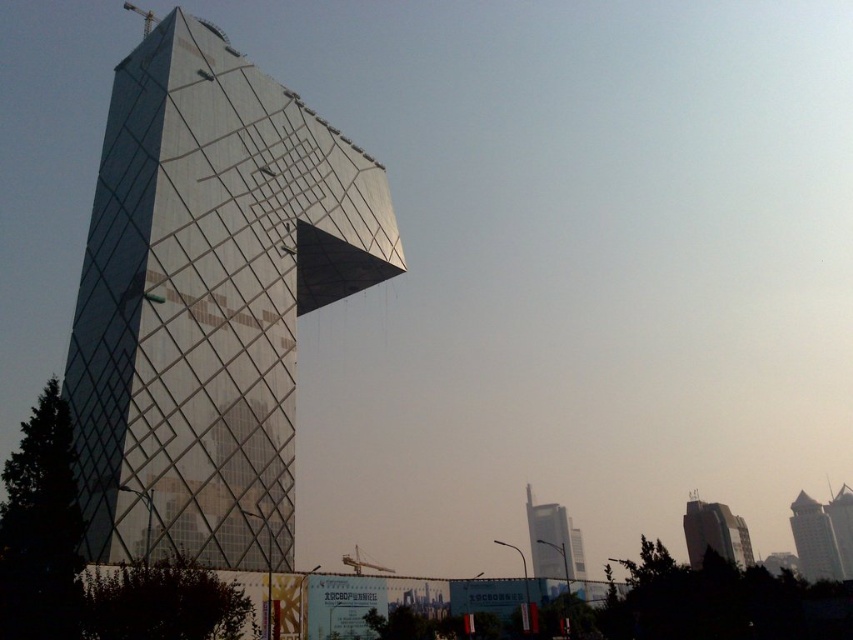
Question: Does matte glass building at lower right have a lesser width compared to silver glass skyscraper at center?

Choices:
 (A) yes
 (B) no

Answer: (B)

Question: Which point appears farthest from the camera in this image?

Choices:
 (A) (693, 493)
 (B) (112, 243)
 (C) (552, 568)
 (D) (799, 541)

Answer: (A)

Question: Which of the following is the farthest from the observer?

Choices:
 (A) silver glass skyscraper at center
 (B) matte glass building at lower right

Answer: (A)

Question: Is glassy silver skyscraper at center above silver glass skyscraper at center?

Choices:
 (A) yes
 (B) no

Answer: (A)

Question: Which point is farther to the camera?

Choices:
 (A) glassy silver skyscraper at center
 (B) silver glass skyscraper at center
 (C) metallic glass tower at center

Answer: (B)

Question: Can you confirm if matte glass building at lower right is wider than silver glass skyscraper at center?

Choices:
 (A) yes
 (B) no

Answer: (A)